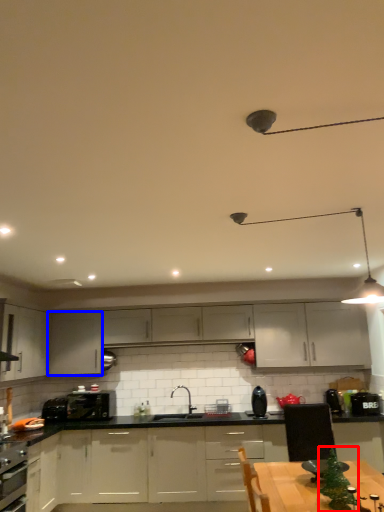
Question: Which object appears closest to the camera in this image, christmas tree (highlighted by a red box) or cabinetry (highlighted by a blue box)?

Choices:
 (A) christmas tree
 (B) cabinetry

Answer: (A)